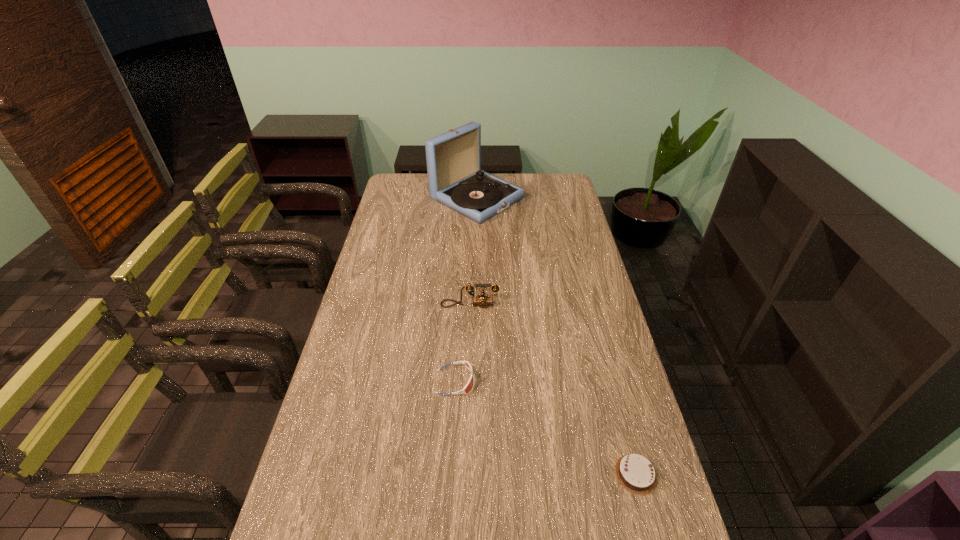
At what (x,y) coordinates should I click in order to perform the action: click on vacant point that satisfies the following two spatial constraints: 1. on the front-facing side of the second tallest object; 2. on the front-facing side of the goggles. Please return your answer as a coordinate pair (x, y). Image resolution: width=960 pixels, height=540 pixels. Looking at the image, I should click on (468, 382).

Find the location of a particular element. vacant region that satisfies the following two spatial constraints: 1. on the front-facing side of the goggles; 2. on the right side of the shortest object is located at coordinates (450, 474).

At what (x,y) coordinates should I click in order to perform the action: click on free location that satisfies the following two spatial constraints: 1. on the front-facing side of the goggles; 2. on the left side of the shortest object. Please return your answer as a coordinate pair (x, y). This screenshot has width=960, height=540. Looking at the image, I should click on (450, 474).

Identify the location of free point that satisfies the following two spatial constraints: 1. on the front-facing side of the shortest object; 2. on the left side of the telephone. (466, 474).